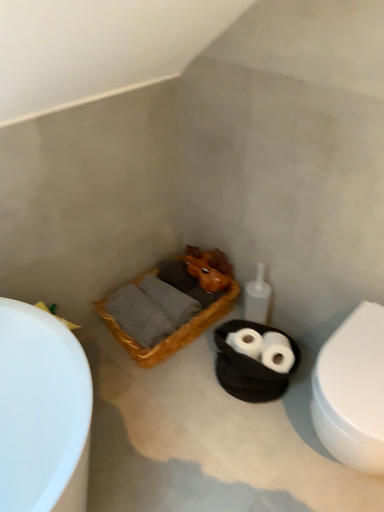
Where is `free space in front of woven wood basket at center`? The image size is (384, 512). free space in front of woven wood basket at center is located at coordinates (175, 408).